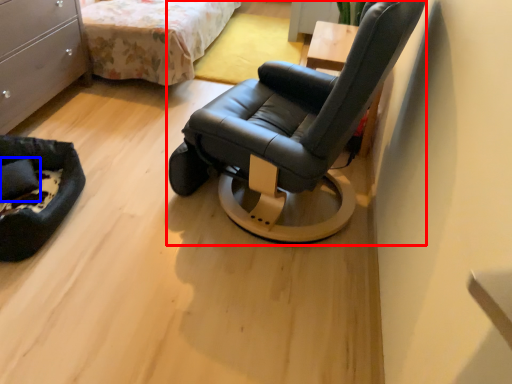
Question: Which point is further to the camera, chair (highlighted by a red box) or pillow (highlighted by a blue box)?

Choices:
 (A) chair
 (B) pillow

Answer: (B)